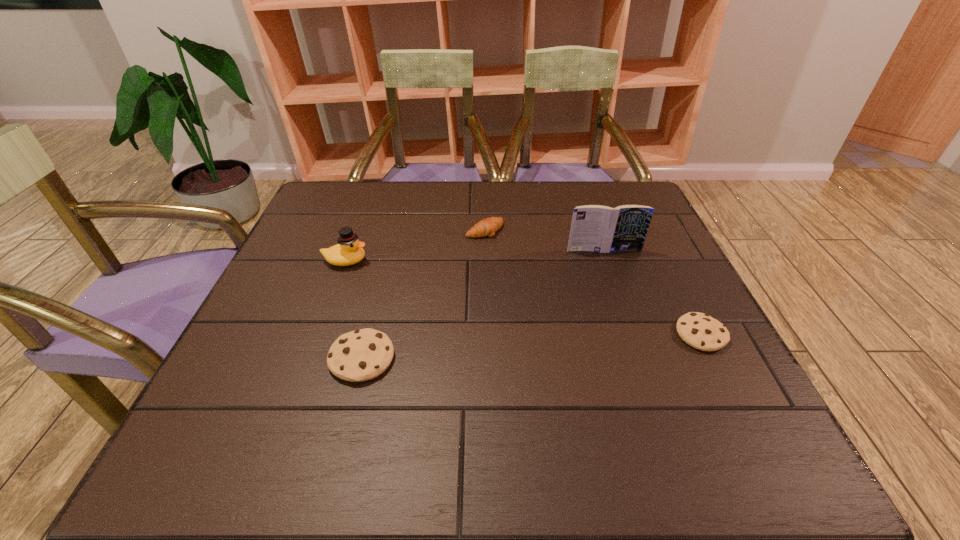
Identify the location of blank space at the right edge of the desktop. This screenshot has width=960, height=540. (657, 247).

Where is `free location at the far right corner of the desktop`? The image size is (960, 540). free location at the far right corner of the desktop is located at coordinates (654, 217).

This screenshot has height=540, width=960. In order to click on vacant point located between the shorter cookie and the third shortest object in this screenshot , I will do `click(532, 346)`.

Where is `empty location between the fourth shortest object and the third object from left to right`? empty location between the fourth shortest object and the third object from left to right is located at coordinates (415, 246).

Locate an element on the screen. The image size is (960, 540). unoccupied position between the taller cookie and the duck is located at coordinates (353, 309).

Where is `vacant area that lies between the book and the third shortest object`? The height and width of the screenshot is (540, 960). vacant area that lies between the book and the third shortest object is located at coordinates (483, 304).

The image size is (960, 540). What are the coordinates of `free space between the farthest object and the shorter cookie` in the screenshot? It's located at (593, 282).

The image size is (960, 540). Identify the location of free area in between the shorter cookie and the fourth shortest object. (523, 298).

Locate an element on the screen. The image size is (960, 540). vacant space that is in between the duck and the shorter cookie is located at coordinates (523, 298).

Where is `free space between the crescent roll and the tallest object`? This screenshot has height=540, width=960. free space between the crescent roll and the tallest object is located at coordinates (544, 240).